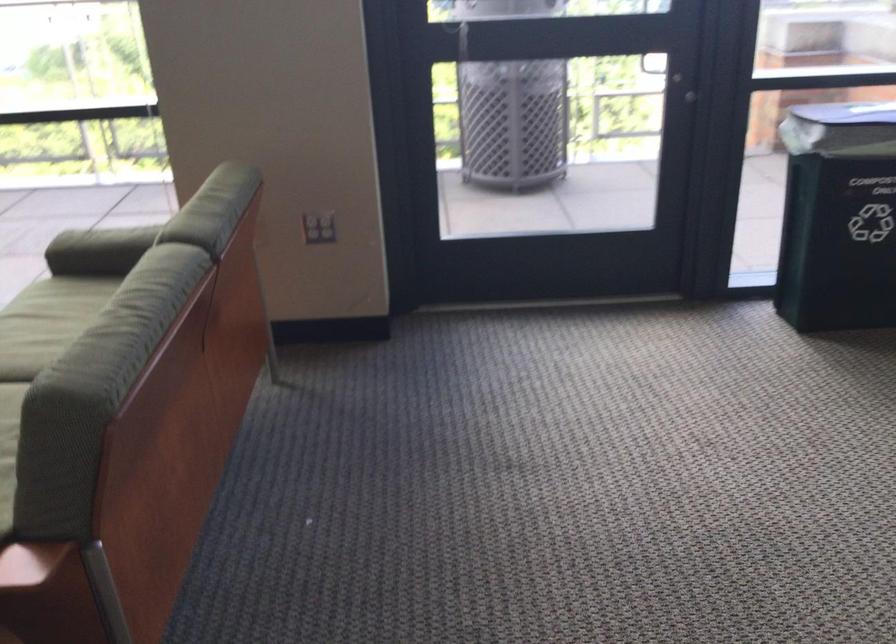
What do you see at coordinates (46, 323) in the screenshot?
I see `a green sofa sitting surface` at bounding box center [46, 323].